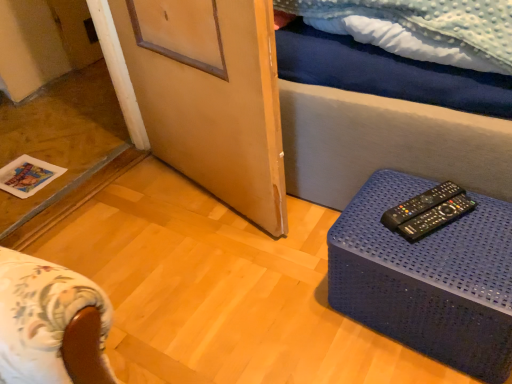
In order to face black plastic remote controls at right, which ranks as the 1th remote control in front-to-back order, should I rotate leftwards or rightwards?

You should rotate right by 22.991 degrees.

What do you see at coordinates (211, 96) in the screenshot? I see `wooden screen door at center` at bounding box center [211, 96].

The height and width of the screenshot is (384, 512). What are the coordinates of `black plastic remote controls at right, arranged as the 2th remote control when viewed from the back` in the screenshot? It's located at (436, 217).

Is black plastic remote control at right, positioned as the 1th remote control in back-to-front order, bigger than black plastic remote controls at right, which ranks as the 1th remote control in front-to-back order?

No.

From a real-world perspective, who is located lower, black plastic remote control at right, positioned as the 1th remote control in back-to-front order, or black plastic remote controls at right, arranged as the 2th remote control when viewed from the back?

black plastic remote controls at right, arranged as the 2th remote control when viewed from the back, is physically lower.

Is black plastic remote control at right, the 2th remote control when ordered from front to back, positioned with its back to black plastic remote controls at right, which ranks as the 1th remote control in front-to-back order?

No, black plastic remote controls at right, which ranks as the 1th remote control in front-to-back order, is not at the back of black plastic remote control at right, the 2th remote control when ordered from front to back.

Considering the sizes of objects black plastic remote control at right, the 2th remote control when ordered from front to back, and black plastic remote controls at right, arranged as the 2th remote control when viewed from the back, in the image provided, who is taller, black plastic remote control at right, the 2th remote control when ordered from front to back, or black plastic remote controls at right, arranged as the 2th remote control when viewed from the back,?

black plastic remote controls at right, arranged as the 2th remote control when viewed from the back.

Who is bigger, wooden screen door at center or black plastic remote controls at right, which ranks as the 1th remote control in front-to-back order?

Bigger between the two is wooden screen door at center.

Who is shorter, wooden screen door at center or black plastic remote controls at right, which ranks as the 1th remote control in front-to-back order?

black plastic remote controls at right, which ranks as the 1th remote control in front-to-back order.

Between wooden screen door at center and black plastic remote controls at right, arranged as the 2th remote control when viewed from the back, which one has smaller width?

wooden screen door at center is thinner.

Considering the positions of objects blue plastic table at lower right and wooden screen door at center in the image provided, who is in front, blue plastic table at lower right or wooden screen door at center?

blue plastic table at lower right.

Based on the photo, is blue plastic table at lower right aimed at wooden screen door at center?

No, blue plastic table at lower right is not turned towards wooden screen door at center.

Which is more to the left, blue plastic table at lower right or wooden screen door at center?

Positioned to the left is wooden screen door at center.

Can you tell me how much blue plastic table at lower right and wooden screen door at center differ in facing direction?

They differ by 12.2 degrees in their facing directions.

Can you confirm if black plastic remote controls at right, which ranks as the 1th remote control in front-to-back order, is smaller than wooden screen door at center?

Answer: Indeed, black plastic remote controls at right, which ranks as the 1th remote control in front-to-back order, has a smaller size compared to wooden screen door at center.

From the image's perspective, which object appears higher, black plastic remote controls at right, which ranks as the 1th remote control in front-to-back order, or wooden screen door at center?

wooden screen door at center, from the image's perspective.

Consider the image. Do you think black plastic remote controls at right, which ranks as the 1th remote control in front-to-back order, is within wooden screen door at center, or outside of it?

black plastic remote controls at right, which ranks as the 1th remote control in front-to-back order, exists outside the volume of wooden screen door at center.

In the scene shown: How different are the orientations of black plastic remote controls at right, arranged as the 2th remote control when viewed from the back, and wooden screen door at center in degrees?

15.9 degrees.

How far apart are wooden screen door at center and blue plastic table at lower right?

wooden screen door at center is 20.51 inches from blue plastic table at lower right.

Which is nearer, (236,154) or (463,218)?

Point (236,154).

From the picture: Between wooden screen door at center and blue plastic table at lower right, which one has smaller size?

blue plastic table at lower right is smaller.

Locate an element on the screen. The image size is (512, 384). screen door on the left of blue plastic table at lower right is located at coordinates (211, 96).

Could you tell me if blue plastic table at lower right is facing black plastic remote control at right, the 2th remote control when ordered from front to back?

No, blue plastic table at lower right does not turn towards black plastic remote control at right, the 2th remote control when ordered from front to back.

Considering the relative positions of blue plastic table at lower right and black plastic remote control at right, the 2th remote control when ordered from front to back, in the image provided, is blue plastic table at lower right to the left of black plastic remote control at right, the 2th remote control when ordered from front to back, from the viewer's perspective?

No.

Identify the location of table in front of the black plastic remote control at right, the 2th remote control when ordered from front to back. The image size is (512, 384). (428, 277).

Is blue plastic table at lower right closer to the viewer compared to black plastic remote control at right, positioned as the 1th remote control in back-to-front order?

Yes.

How much distance is there between black plastic remote controls at right, which ranks as the 1th remote control in front-to-back order, and black plastic remote control at right, the 2th remote control when ordered from front to back?

black plastic remote controls at right, which ranks as the 1th remote control in front-to-back order, and black plastic remote control at right, the 2th remote control when ordered from front to back, are 1.20 inches apart.

Do you think black plastic remote controls at right, arranged as the 2th remote control when viewed from the back, is within black plastic remote control at right, positioned as the 1th remote control in back-to-front order, or outside of it?

black plastic remote controls at right, arranged as the 2th remote control when viewed from the back, is outside black plastic remote control at right, positioned as the 1th remote control in back-to-front order.

How different are the orientations of black plastic remote controls at right, which ranks as the 1th remote control in front-to-back order, and black plastic remote control at right, the 2th remote control when ordered from front to back, in degrees?

0.00179 degrees.

Who is bigger, black plastic remote controls at right, which ranks as the 1th remote control in front-to-back order, or black plastic remote control at right, the 2th remote control when ordered from front to back?

black plastic remote controls at right, which ranks as the 1th remote control in front-to-back order, is bigger.

Find the location of a particular element. This screenshot has height=384, width=512. remote control beneath the black plastic remote control at right, positioned as the 1th remote control in back-to-front order (from a real-world perspective) is located at coordinates (436, 217).

Locate an element on the screen. Image resolution: width=512 pixels, height=384 pixels. the 2nd remote control to the right of the wooden screen door at center, counting from the anchor's position is located at coordinates (436, 217).

Based on their spatial positions, is black plastic remote control at right, the 2th remote control when ordered from front to back, or blue plastic table at lower right closer to wooden screen door at center?

Based on the image, blue plastic table at lower right appears to be nearer to wooden screen door at center.

From the image, which object appears to be farther from black plastic remote control at right, positioned as the 1th remote control in back-to-front order, wooden screen door at center or black plastic remote controls at right, arranged as the 2th remote control when viewed from the back?

wooden screen door at center lies further to black plastic remote control at right, positioned as the 1th remote control in back-to-front order, than the other object.

Based on their spatial positions, is blue plastic table at lower right or wooden screen door at center closer to black plastic remote control at right, the 2th remote control when ordered from front to back?

Based on the image, blue plastic table at lower right appears to be nearer to black plastic remote control at right, the 2th remote control when ordered from front to back.

In the scene shown: Which object lies nearer to the anchor point wooden screen door at center, black plastic remote controls at right, which ranks as the 1th remote control in front-to-back order, or blue plastic table at lower right?

blue plastic table at lower right.

When comparing their distances from black plastic remote control at right, positioned as the 1th remote control in back-to-front order, does wooden screen door at center or blue plastic table at lower right seem further?

Among the two, wooden screen door at center is located further to black plastic remote control at right, positioned as the 1th remote control in back-to-front order.

When comparing their distances from blue plastic table at lower right, does black plastic remote controls at right, arranged as the 2th remote control when viewed from the back, or black plastic remote control at right, positioned as the 1th remote control in back-to-front order, seem further?

Based on the image, black plastic remote control at right, positioned as the 1th remote control in back-to-front order, appears to be further to blue plastic table at lower right.

Which object lies further to the anchor point black plastic remote control at right, positioned as the 1th remote control in back-to-front order, black plastic remote controls at right, arranged as the 2th remote control when viewed from the back, or blue plastic table at lower right?

blue plastic table at lower right is further to black plastic remote control at right, positioned as the 1th remote control in back-to-front order.

When comparing their distances from blue plastic table at lower right, does black plastic remote control at right, positioned as the 1th remote control in back-to-front order, or wooden screen door at center seem further?

wooden screen door at center lies further to blue plastic table at lower right than the other object.

This screenshot has width=512, height=384. I want to click on remote control between wooden screen door at center and black plastic remote controls at right, which ranks as the 1th remote control in front-to-back order, from left to right, so click(x=419, y=204).

You are a GUI agent. You are given a task and a screenshot of the screen. Output one action in this format:
    pyautogui.click(x=<x>, y=<y>)
    Task: Click on the remote control located between blue plastic table at lower right and black plastic remote control at right, positioned as the 1th remote control in back-to-front order, in the depth direction
    The image size is (512, 384).
    Given the screenshot: What is the action you would take?
    pyautogui.click(x=436, y=217)